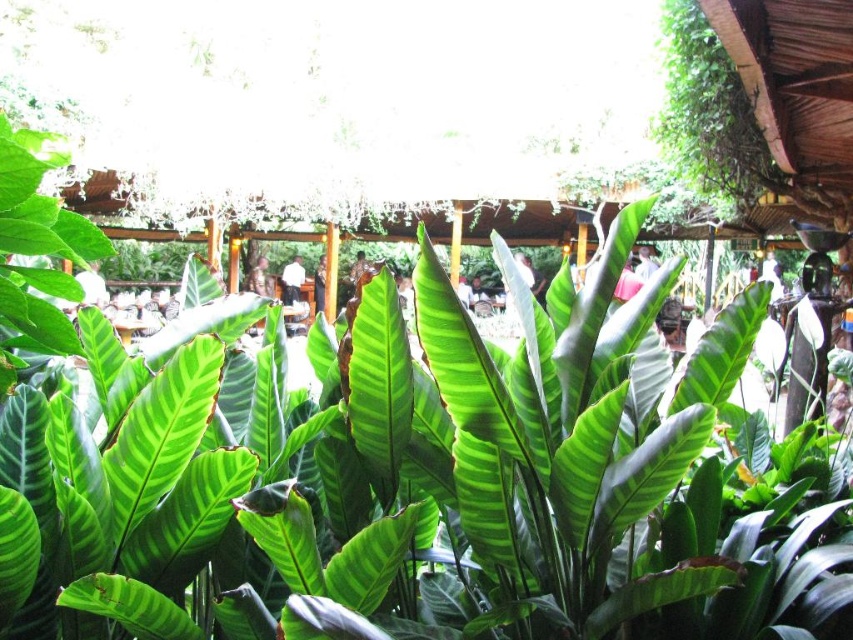
You are standing in the tropical garden and want to place a small potted plant between the light brown wooden chair at center and the dark brown leather jacket at center. Which object should the potted plant be closer to in order to be placed directly in front of the chair?

The potted plant should be placed closer to the light brown wooden chair at center since it is closer to the viewer than the dark brown leather jacket at center, ensuring it is directly in front of the chair.

You are standing at the entrance of the tropical garden and see the white fabric shirt at upper center represented by point (645, 260). Is this point located to the left or right of the center of the image?

The point (645, 260) is at upper center, so it is centered horizontally. Therefore, it is neither to the left nor right of the center of the image.